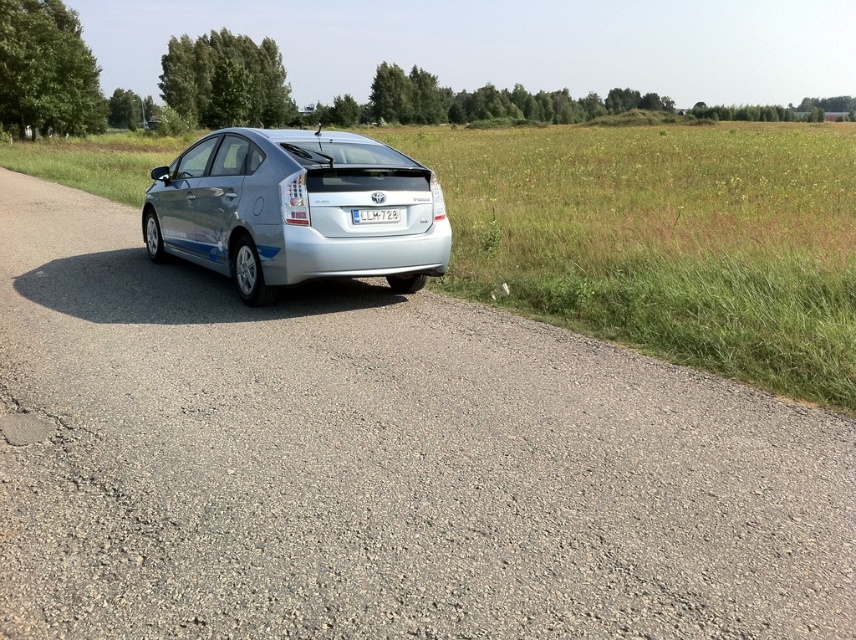
Between point (420, 166) and point (354, 220), which one is positioned behind?

Positioned behind is point (420, 166).

Locate an element on the screen. The image size is (856, 640). silver metallic car at center is located at coordinates (295, 211).